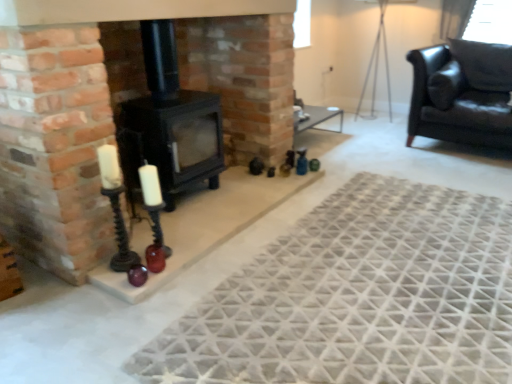
Question: From the image's perspective, does black glass candle holder at lower left, placed as the 1th candle holder when sorted from right to left, appear higher than black matte wood burning stove at center?

Choices:
 (A) yes
 (B) no

Answer: (B)

Question: Would you say black glass candle holder at lower left, placed as the 1th candle holder when sorted from right to left, is outside black matte wood burning stove at center?

Choices:
 (A) no
 (B) yes

Answer: (B)

Question: From a real-world perspective, is black glass candle holder at lower left, positioned as the 2th candle holder in left-to-right order, physically below black matte wood burning stove at center?

Choices:
 (A) no
 (B) yes

Answer: (B)

Question: Does black glass candle holder at lower left, placed as the 1th candle holder when sorted from right to left, appear on the right side of black matte wood burning stove at center?

Choices:
 (A) yes
 (B) no

Answer: (A)

Question: Considering the relative sizes of black glass candle holder at lower left, placed as the 1th candle holder when sorted from right to left, and black matte wood burning stove at center in the image provided, is black glass candle holder at lower left, placed as the 1th candle holder when sorted from right to left, wider than black matte wood burning stove at center?

Choices:
 (A) yes
 (B) no

Answer: (B)

Question: Choose the correct answer: Is textured gray rug at center inside black matte wood burning stove at center or outside it?

Choices:
 (A) inside
 (B) outside

Answer: (B)

Question: Looking at their shapes, would you say textured gray rug at center is wider or thinner than black matte wood burning stove at center?

Choices:
 (A) thin
 (B) wide

Answer: (B)

Question: Does point (423, 243) appear closer or farther from the camera than point (155, 56)?

Choices:
 (A) closer
 (B) farther

Answer: (A)

Question: From a real-world perspective, relative to black matte wood burning stove at center, is textured gray rug at center vertically above or below?

Choices:
 (A) below
 (B) above

Answer: (A)

Question: Looking at the image, does textured gray rug at center seem bigger or smaller compared to black glass candle holder at lower left, positioned as the 2th candle holder in left-to-right order?

Choices:
 (A) small
 (B) big

Answer: (B)

Question: Choose the correct answer: Is textured gray rug at center inside black glass candle holder at lower left, placed as the 1th candle holder when sorted from right to left, or outside it?

Choices:
 (A) inside
 (B) outside

Answer: (B)

Question: Is point (249, 266) closer or farther from the camera than point (154, 173)?

Choices:
 (A) farther
 (B) closer

Answer: (A)

Question: In terms of height, does textured gray rug at center look taller or shorter compared to black glass candle holder at lower left, positioned as the 2th candle holder in left-to-right order?

Choices:
 (A) short
 (B) tall

Answer: (A)

Question: Considering the positions of black wrought iron candle holder at left, marked as the 2th candle holder in a right-to-left arrangement, and textured gray rug at center in the image, is black wrought iron candle holder at left, marked as the 2th candle holder in a right-to-left arrangement, wider or thinner than textured gray rug at center?

Choices:
 (A) wide
 (B) thin

Answer: (B)

Question: Relative to textured gray rug at center, is black wrought iron candle holder at left, marked as the 1th candle holder in a left-to-right arrangement, in front or behind?

Choices:
 (A) behind
 (B) front

Answer: (A)